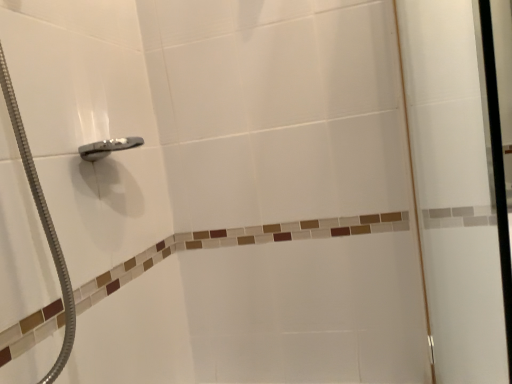
Describe the element at coordinates (453, 190) in the screenshot. The width and height of the screenshot is (512, 384). I see `transparent glass screen door at right` at that location.

Where is `transparent glass screen door at right`? The width and height of the screenshot is (512, 384). transparent glass screen door at right is located at coordinates (453, 190).

What is the approximate width of transparent glass screen door at right?

transparent glass screen door at right is 5.39 centimeters wide.

At what (x,y) coordinates should I click in order to perform the action: click on transparent glass screen door at right. Please return your answer as a coordinate pair (x, y). This screenshot has width=512, height=384. Looking at the image, I should click on (453, 190).